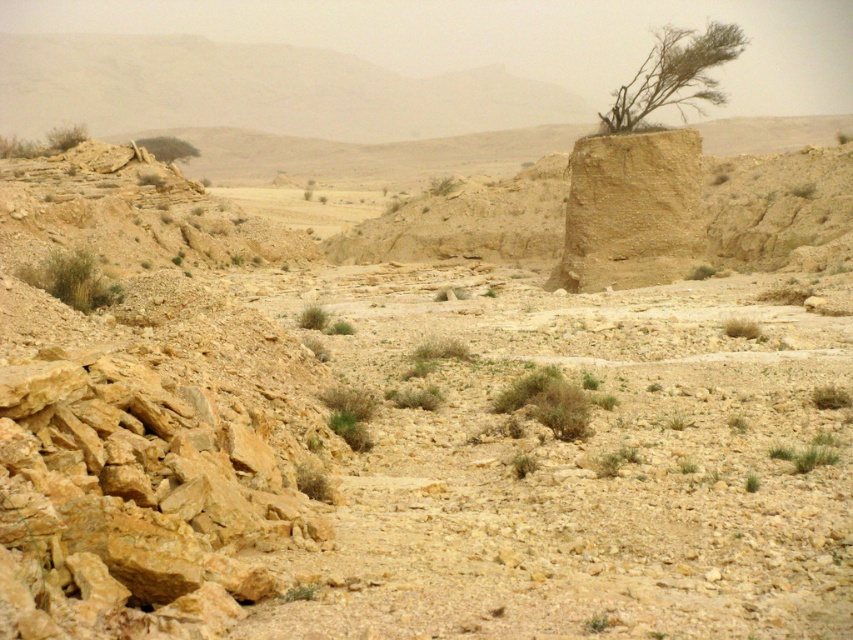
You are a hiker trying to navigate the desert and need to locate the green leafy tree at upper left. According to the scene, where should you look relative to the brown clay rock at center?

The brown clay rock at center is below the green leafy tree at upper left, so you should look above the brown clay rock at center to find the green leafy tree at upper left.

You are a desert explorer who needs to mark your location using a flag. You have a flagpole that is 2 meters tall. If you want to place the flagpole so that it is taller than both the brown clay rock at center and the green leafy bush at center, where should you place it?

The brown clay rock at center is much taller than the green leafy bush at center. Since the flagpole is only 2 meters tall, it cannot be placed anywhere to be taller than both objects because the brown clay rock at center is already taller than the flagpole.

You are a desert explorer trying to navigate through the rugged terrain. You see the brown clay rock at center and the green leafy bush at center. Which object is higher up in the scene?

The brown clay rock at center is located above the green leafy bush at center, so it is higher up in the scene.